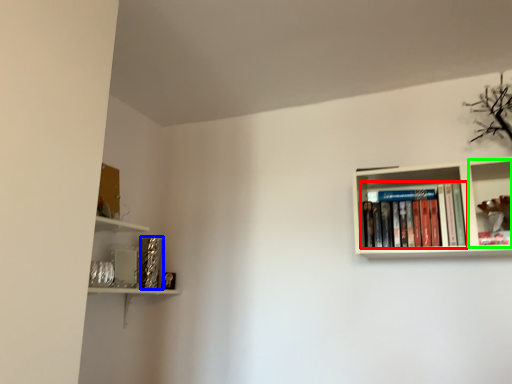
Question: Which object is positioned closest to book (highlighted by a red box)? Select from paperback book (highlighted by a blue box) and shelf (highlighted by a green box).

Choices:
 (A) paperback book
 (B) shelf

Answer: (B)